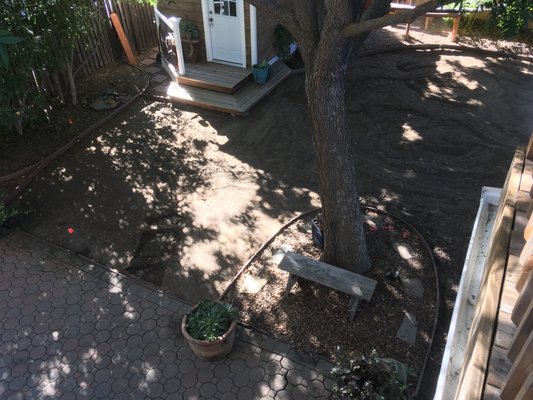
Locate an element on the screen. flower pot is located at coordinates (217, 352).